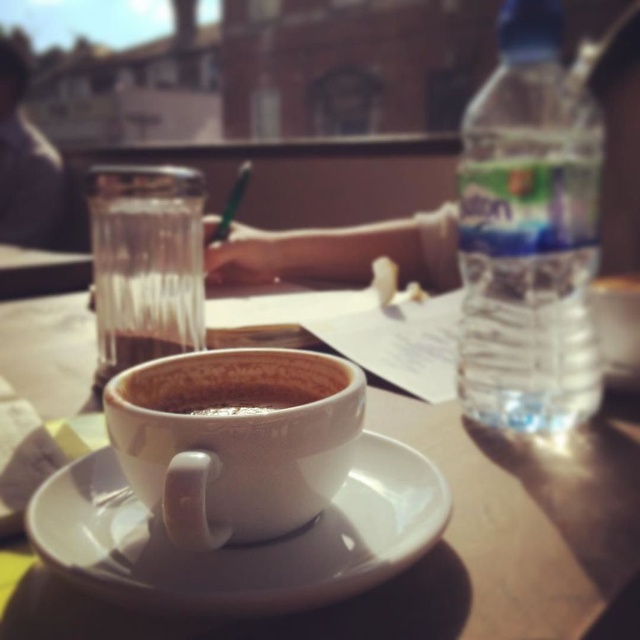
Who is positioned more to the right, white ceramic saucer at center or white ceramic mug at center?

white ceramic saucer at center

Is white ceramic saucer at center smaller than white ceramic mug at center?

No, white ceramic saucer at center is not smaller than white ceramic mug at center.

The width and height of the screenshot is (640, 640). Describe the element at coordinates (241, 545) in the screenshot. I see `white ceramic saucer at center` at that location.

This screenshot has height=640, width=640. What are the coordinates of `white ceramic saucer at center` in the screenshot? It's located at (241, 545).

Is clear plastic bottle at right wider than white ceramic saucer at center?

No.

Who is positioned more to the left, clear plastic bottle at right or white ceramic saucer at center?

white ceramic saucer at center

Does point (524, 291) come closer to viewer compared to point (324, 552)?

No, (524, 291) is behind (324, 552).

The height and width of the screenshot is (640, 640). I want to click on clear plastic bottle at right, so click(x=529, y=234).

Who is taller, white ceramic cup at center or clear glass at center?

clear glass at center is taller.

Is white ceramic cup at center smaller than clear glass at center?

Incorrect, white ceramic cup at center is not smaller in size than clear glass at center.

Does point (588, 548) lie in front of point (154, 204)?

Yes, it is in front of point (154, 204).

This screenshot has height=640, width=640. I want to click on white ceramic cup at center, so click(448, 540).